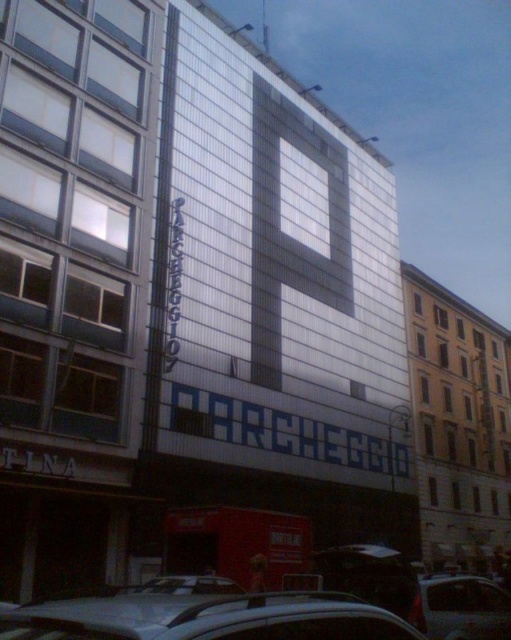
Based on the photo, you are a delivery driver who needs to park your silver metallic car at lower center exactly at point A. The parking spot at point A is located at coordinates 0.967, 0.405. Can you confirm if your car is already parked at point A?

Yes, the silver metallic car at lower center is already positioned at point A since its coordinates are exactly (206, 618) as specified.

You are a delivery driver who needs to park your truck in the parking lot near the silver metallic car at lower center and the metallic gray sedan at lower right. Your truck is 6 meters long. Can you park your truck between them without overlapping either vehicle?

The silver metallic car at lower center is shorter than the metallic gray sedan at lower right. However, the exact length of the space between them is not provided. Therefore, it is uncertain if the truck can fit without overlapping either vehicle.